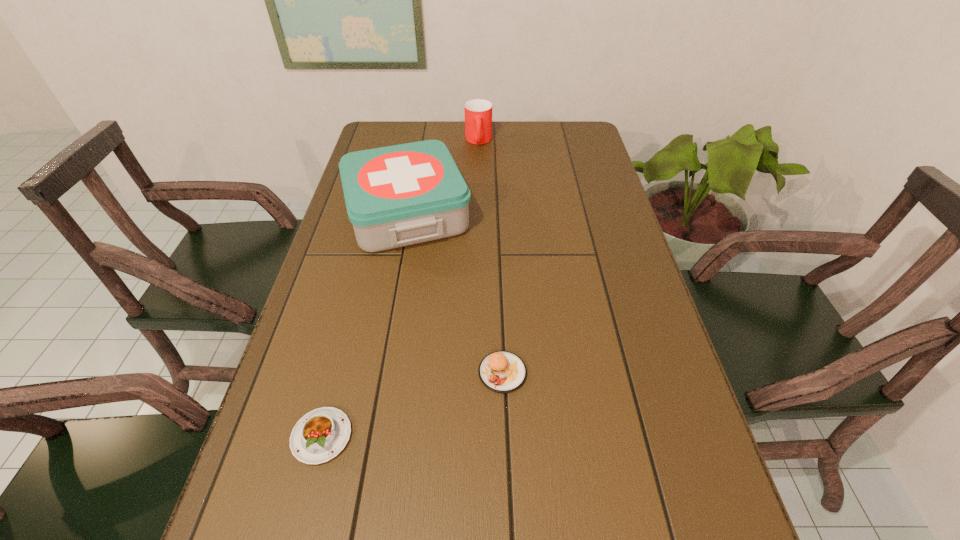
Find the location of a particular element. the first-aid kit is located at coordinates (400, 195).

Identify the location of the farthest object. (478, 113).

The width and height of the screenshot is (960, 540). What are the coordinates of `patty` in the screenshot? It's located at (501, 371).

Locate an element on the screen. the second nearest object is located at coordinates (501, 371).

The image size is (960, 540). What are the coordinates of `the nearest object` in the screenshot? It's located at (320, 435).

Where is `pudding`? This screenshot has height=540, width=960. pudding is located at coordinates (320, 435).

I want to click on vacant space located on the front of the third nearest object, so click(x=379, y=365).

You are a GUI agent. You are given a task and a screenshot of the screen. Output one action in this format:
    pyautogui.click(x=<x>, y=<y>)
    Task: Click on the vacant space positioned 0.300m on the side of the farthest object with the handle
    The height and width of the screenshot is (540, 960).
    Given the screenshot: What is the action you would take?
    pyautogui.click(x=478, y=202)

In order to click on vacant region located 0.200m on the back of the third tallest object in this screenshot , I will do `click(499, 285)`.

You are a GUI agent. You are given a task and a screenshot of the screen. Output one action in this format:
    pyautogui.click(x=<x>, y=<y>)
    Task: Click on the free space located on the right of the nearest object
    Image resolution: width=960 pixels, height=540 pixels.
    Given the screenshot: What is the action you would take?
    pyautogui.click(x=560, y=436)